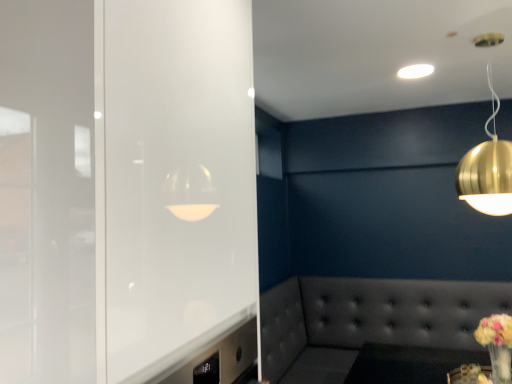
Question: Is gold metallic sphere at upper right, positioned as the first lamp in front-to-back order, at the right side of pastel yellow bouquet at lower right?

Choices:
 (A) yes
 (B) no

Answer: (B)

Question: Can you confirm if gold metallic sphere at upper right, the 2th lamp from the top, is smaller than pastel yellow bouquet at lower right?

Choices:
 (A) no
 (B) yes

Answer: (A)

Question: Is gold metallic sphere at upper right, positioned as the first lamp in front-to-back order, positioned far away from pastel yellow bouquet at lower right?

Choices:
 (A) no
 (B) yes

Answer: (A)

Question: Is gold metallic sphere at upper right, the 2th lamp from the top, positioned with its back to pastel yellow bouquet at lower right?

Choices:
 (A) yes
 (B) no

Answer: (B)

Question: Does gold metallic sphere at upper right, positioned as the first lamp in front-to-back order, have a greater height compared to pastel yellow bouquet at lower right?

Choices:
 (A) yes
 (B) no

Answer: (A)

Question: Is frosted glass door at left to the left or to the right of white glossy ceiling light at upper center, the first lamp when ordered from top to bottom, in the image?

Choices:
 (A) left
 (B) right

Answer: (A)

Question: Considering the positions of point (232, 233) and point (410, 67), is point (232, 233) closer or farther from the camera than point (410, 67)?

Choices:
 (A) farther
 (B) closer

Answer: (B)

Question: Based on their sizes in the image, would you say frosted glass door at left is bigger or smaller than white glossy ceiling light at upper center, arranged as the first lamp when viewed from the back?

Choices:
 (A) big
 (B) small

Answer: (A)

Question: In the image, is frosted glass door at left positioned in front of or behind white glossy ceiling light at upper center, positioned as the second lamp in front-to-back order?

Choices:
 (A) behind
 (B) front

Answer: (B)

Question: From a real-world perspective, relative to pastel yellow bouquet at lower right, is gold metallic sphere at upper right, the 2th lamp from the top, vertically above or below?

Choices:
 (A) below
 (B) above

Answer: (B)

Question: Based on their sizes in the image, would you say gold metallic sphere at upper right, positioned as the first lamp in front-to-back order, is bigger or smaller than pastel yellow bouquet at lower right?

Choices:
 (A) big
 (B) small

Answer: (A)

Question: Is point (470, 178) closer or farther from the camera than point (497, 377)?

Choices:
 (A) farther
 (B) closer

Answer: (B)

Question: Is gold metallic sphere at upper right, positioned as the first lamp in front-to-back order, wider or thinner than pastel yellow bouquet at lower right?

Choices:
 (A) thin
 (B) wide

Answer: (B)

Question: Looking at their shapes, would you say tufted leather couch at lower right is wider or thinner than white glossy ceiling light at upper center, the 2th lamp in the bottom-to-top sequence?

Choices:
 (A) thin
 (B) wide

Answer: (B)

Question: Looking at the image, does tufted leather couch at lower right seem bigger or smaller compared to white glossy ceiling light at upper center, the first lamp when ordered from top to bottom?

Choices:
 (A) big
 (B) small

Answer: (A)